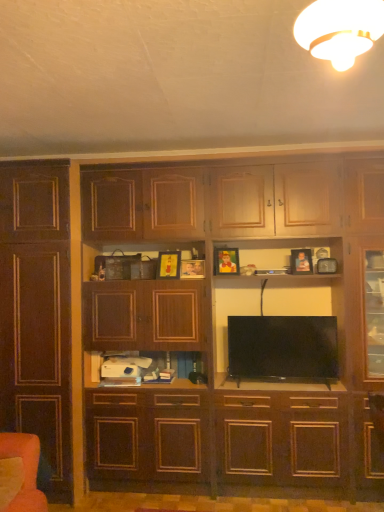
Question: From a real-world perspective, relative to matte brown cabinet at center, is orange fabric armchair at lower left vertically above or below?

Choices:
 (A) above
 (B) below

Answer: (B)

Question: Does point (21, 442) appear closer or farther from the camera than point (148, 379)?

Choices:
 (A) closer
 (B) farther

Answer: (A)

Question: Which object is positioned farthest from the matte brown cabinet at center?

Choices:
 (A) dark wood cupboard at center
 (B) dark wood cabinet at left
 (C) black glossy tv at center
 (D) orange fabric armchair at lower left

Answer: (D)

Question: Which is farther from the dark wood cabinet at left?

Choices:
 (A) orange fabric armchair at lower left
 (B) black glossy tv at center
 (C) dark wood cupboard at center
 (D) matte brown cabinet at center

Answer: (B)